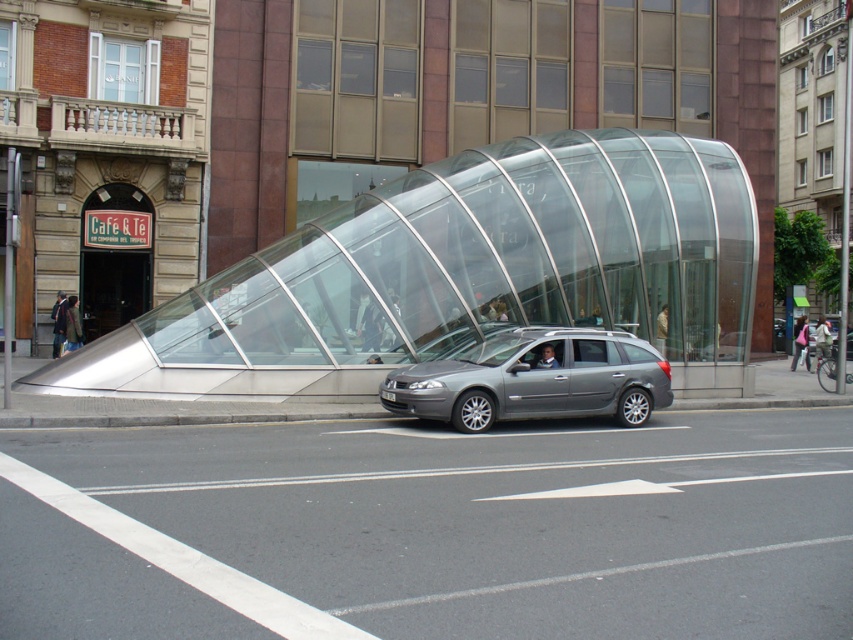
Question: Which point is farther to the camera?

Choices:
 (A) silver metallic car at center
 (B) metallic silver car at center
 (C) metallic gray station wagon at center

Answer: (B)

Question: Can you confirm if silver metallic car at center is smaller than metallic silver car at center?

Choices:
 (A) no
 (B) yes

Answer: (B)

Question: Is metallic silver car at center behind metallic gray station wagon at center?

Choices:
 (A) no
 (B) yes

Answer: (B)

Question: Which point is closer to the camera taking this photo?

Choices:
 (A) tap(550, 172)
 (B) tap(691, 596)

Answer: (B)

Question: Is silver metallic car at center closer to camera compared to metallic silver car at center?

Choices:
 (A) yes
 (B) no

Answer: (A)

Question: Which of these objects is positioned farthest from the metallic gray station wagon at center?

Choices:
 (A) metallic silver car at center
 (B) silver metallic car at center

Answer: (A)